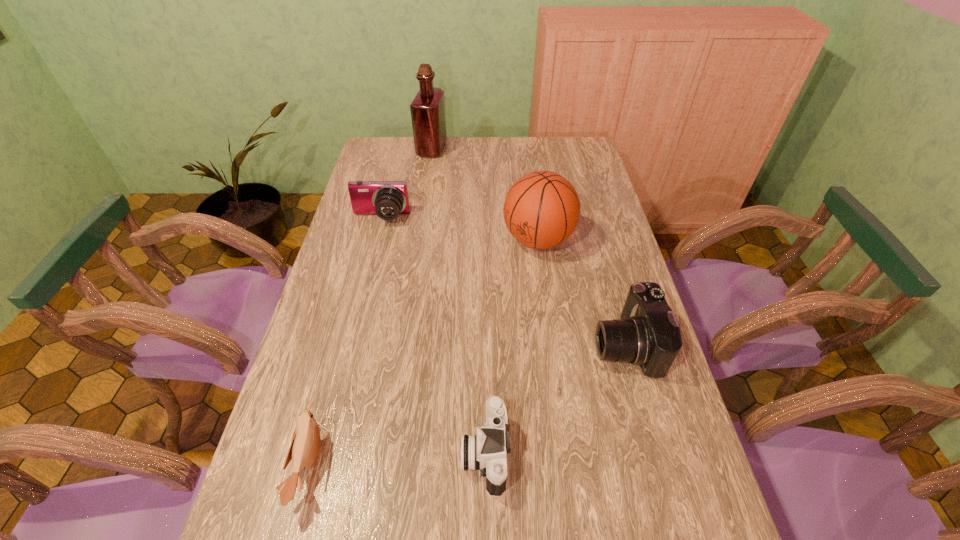
I want to click on free space that satisfies the following two spatial constraints: 1. on the front-facing side of the leftmost camera; 2. on the left side of the second camera from left to right, so click(x=323, y=453).

Identify the location of blank space that satisfies the following two spatial constraints: 1. on the front-facing side of the second tallest object; 2. on the left side of the farthest camera. (375, 240).

In order to click on vacant area in the image that satisfies the following two spatial constraints: 1. on the front-facing side of the leftmost camera; 2. at the beak of the bird in this screenshot , I will do `click(320, 465)`.

The width and height of the screenshot is (960, 540). I want to click on free region that satisfies the following two spatial constraints: 1. on the front side of the second camera from left to right; 2. at the beak of the bird, so pyautogui.click(x=486, y=465).

Find the location of a particular element. free region that satisfies the following two spatial constraints: 1. on the front side of the farthest object; 2. on the right side of the third object from right to left is located at coordinates (387, 453).